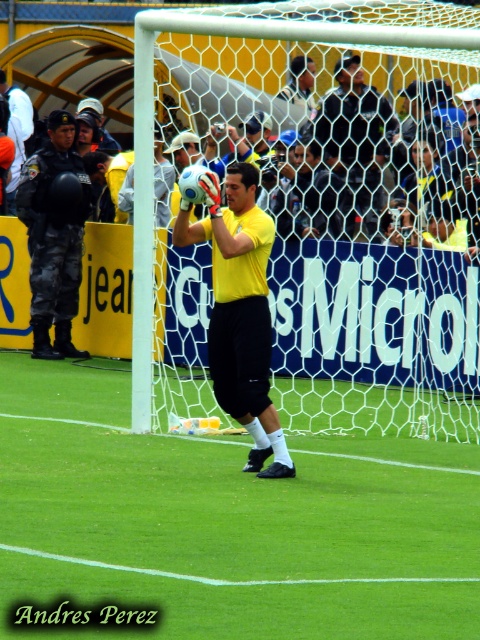
Question: Considering the relative positions of green grass at center and yellow matte jersey at center in the image provided, where is green grass at center located with respect to yellow matte jersey at center?

Choices:
 (A) below
 (B) above

Answer: (A)

Question: Which point is farther to the camera?

Choices:
 (A) (232, 244)
 (B) (37, 340)

Answer: (B)

Question: Among these objects, which one is farthest from the camera?

Choices:
 (A) white mesh net at center
 (B) matte black helmet at left

Answer: (B)

Question: Considering the real-world distances, which object is closest to the yellow matte shirt at center?

Choices:
 (A) green grass at center
 (B) yellow matte jersey at center
 (C) white mesh net at center
 (D) matte black helmet at left

Answer: (C)

Question: Does white mesh net at center appear over green grass at center?

Choices:
 (A) yes
 (B) no

Answer: (A)

Question: Is matte black helmet at left wider than yellow matte shirt at center?

Choices:
 (A) no
 (B) yes

Answer: (A)